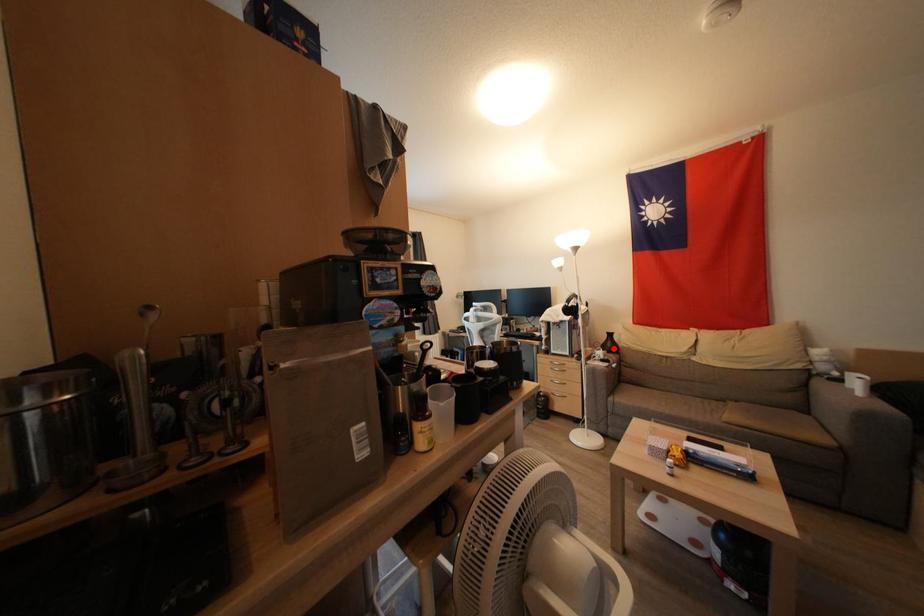
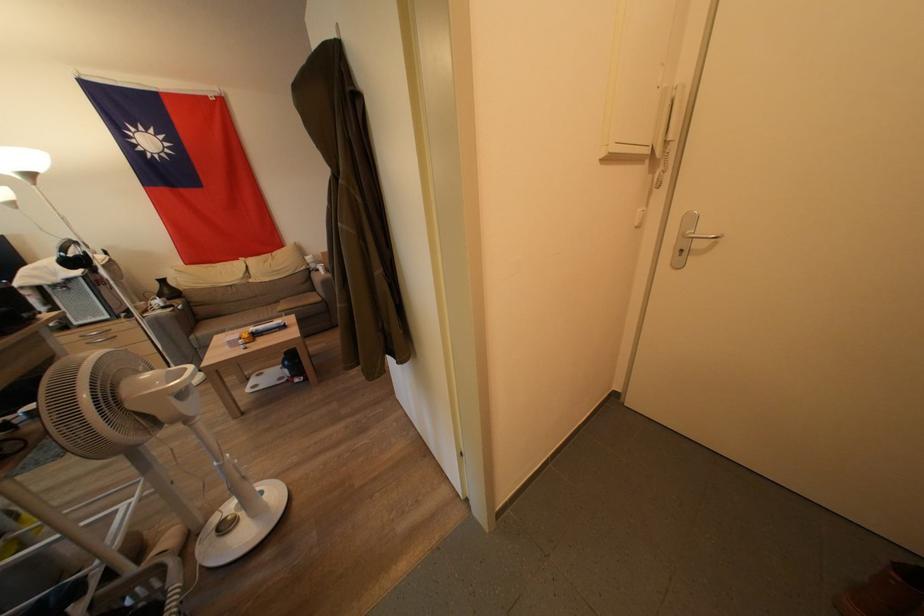
Question: I am providing you with two images of the same scene from different viewpoints. A red point is marked on the first image. Is the red point's position out of view in image 2?

Choices:
 (A) Yes
 (B) No

Answer: (B)